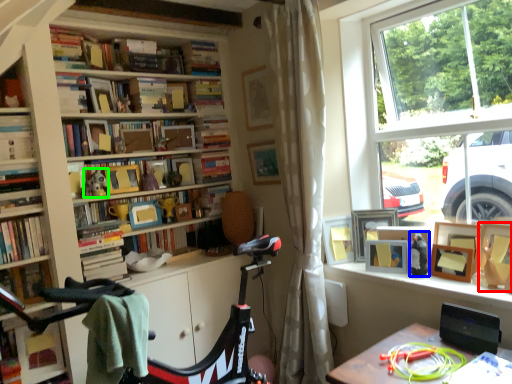
Question: Which is farther away from picture frame (highlighted by a red box)? toy (highlighted by a blue box) or toy (highlighted by a green box)?

Choices:
 (A) toy
 (B) toy

Answer: (B)